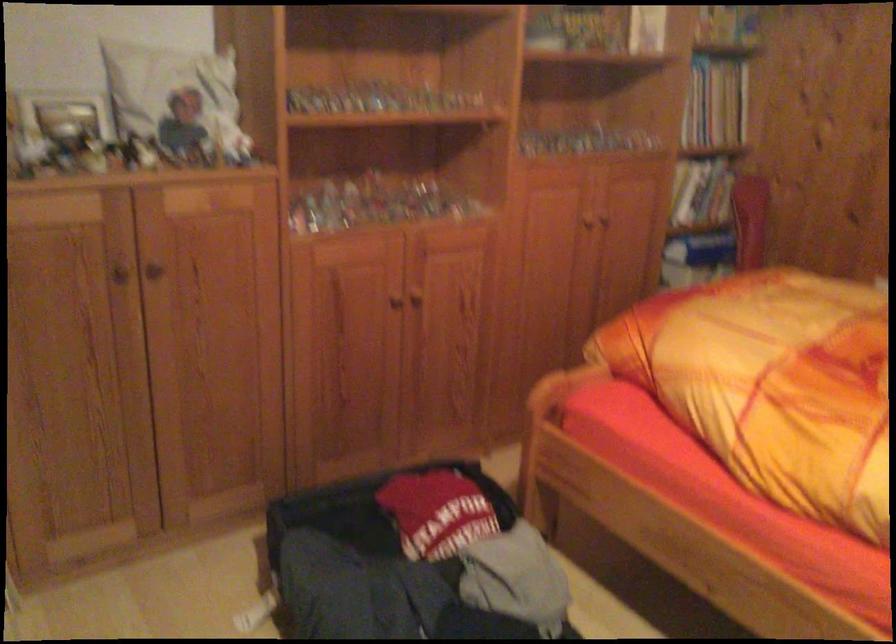
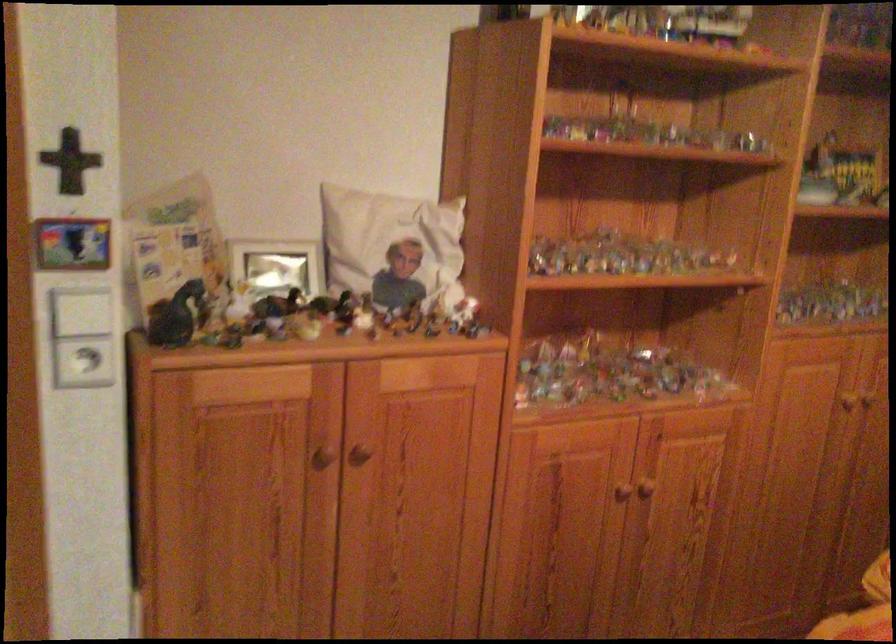
Question: The camera is either moving clockwise (left) or counter-clockwise (right) around the object. The first image is from the beginning of the video and the second image is from the end. Is the camera moving left or right when shooting the video?

Choices:
 (A) Left
 (B) Right

Answer: (B)